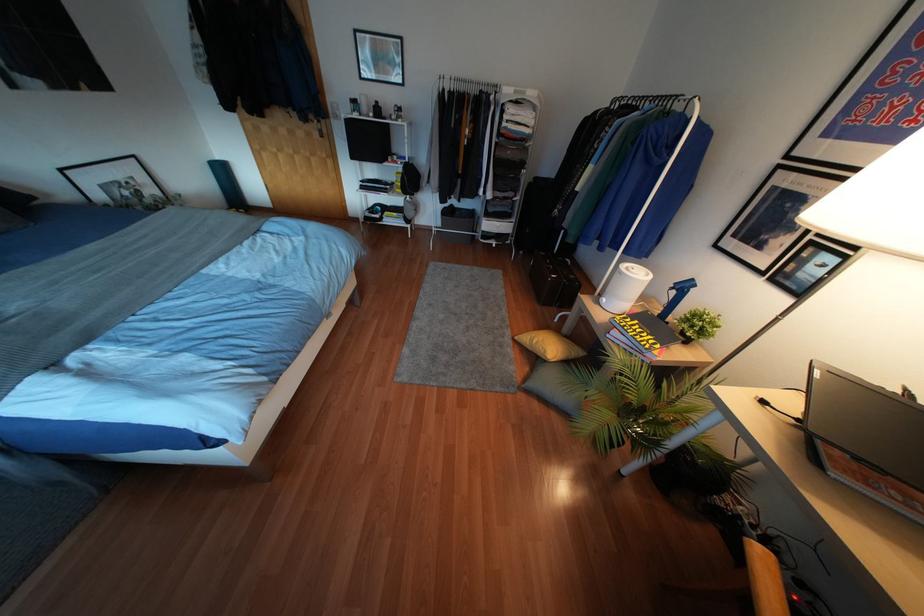
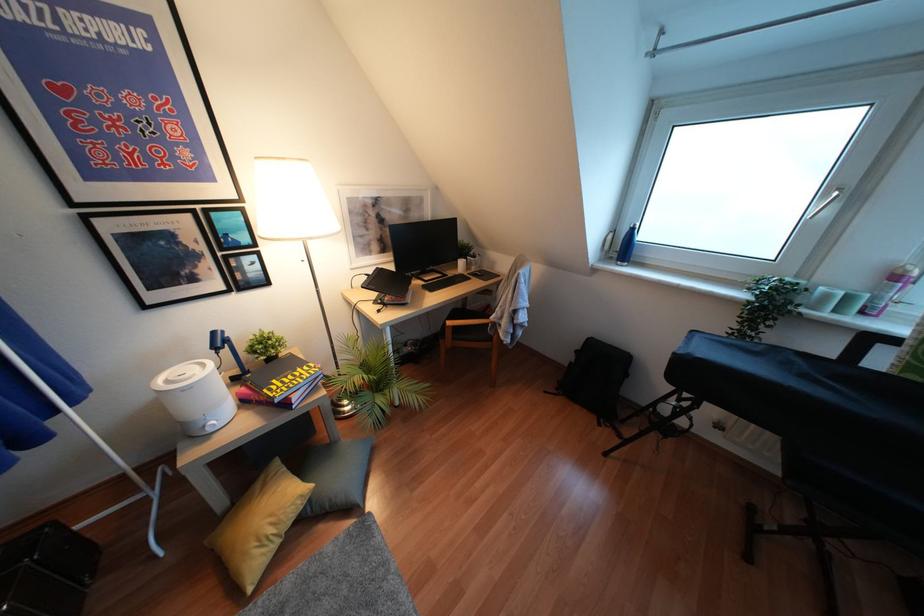
Where in the second image is the point corresponding to point 533,341 from the first image?

(271, 530)